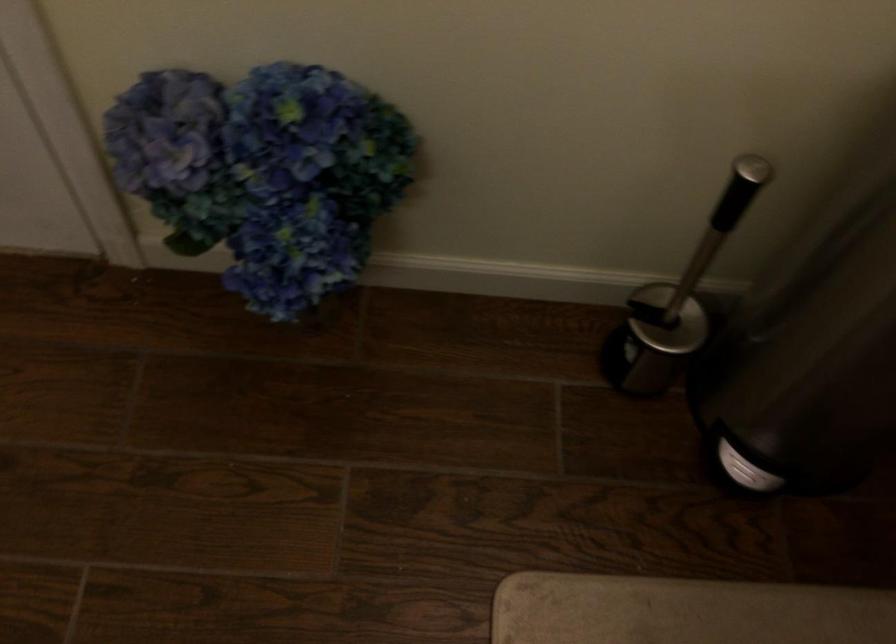
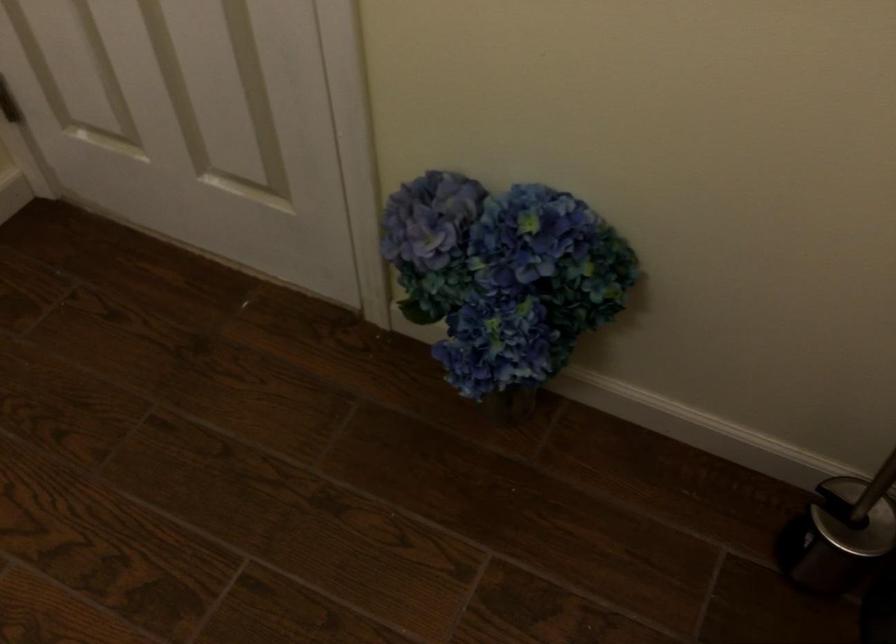
The images are taken continuously from a first-person perspective. In which direction are you moving?

The cameraman moved toward right, backward.